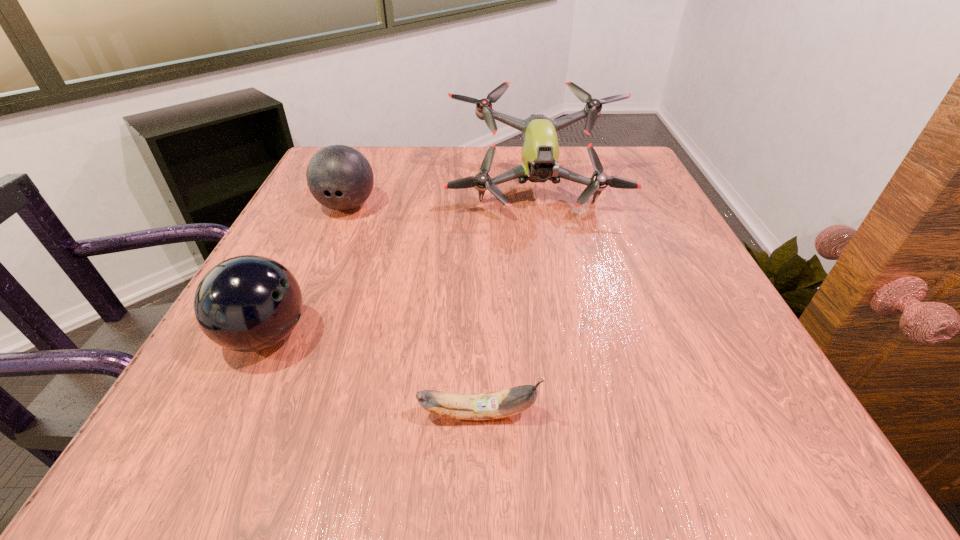
This screenshot has height=540, width=960. I want to click on drone, so pyautogui.click(x=540, y=149).

I want to click on the nearer bowling ball, so click(248, 303).

Image resolution: width=960 pixels, height=540 pixels. What are the coordinates of `the farther bowling ball` in the screenshot? It's located at (339, 177).

The width and height of the screenshot is (960, 540). In order to click on the nearest object in this screenshot , I will do 483,406.

Where is `the shortest object`? This screenshot has width=960, height=540. the shortest object is located at coordinates (483, 406).

You are a GUI agent. You are given a task and a screenshot of the screen. Output one action in this format:
    pyautogui.click(x=<x>, y=<y>)
    Task: Click on the free location located on the front-facing side of the drone
    The width and height of the screenshot is (960, 540).
    Given the screenshot: What is the action you would take?
    pyautogui.click(x=551, y=275)

The width and height of the screenshot is (960, 540). Find the location of `free region located on the side of the nearer bowling ball with the finger holes`. free region located on the side of the nearer bowling ball with the finger holes is located at coordinates (425, 336).

The height and width of the screenshot is (540, 960). What are the coordinates of `vacant space located 0.140m on the grip area of the farther bowling ball` in the screenshot? It's located at (322, 266).

Where is `vacant position located on the peel of the shortest object`? This screenshot has height=540, width=960. vacant position located on the peel of the shortest object is located at coordinates (748, 414).

Locate an element on the screen. drone situated at the far edge is located at coordinates (540, 149).